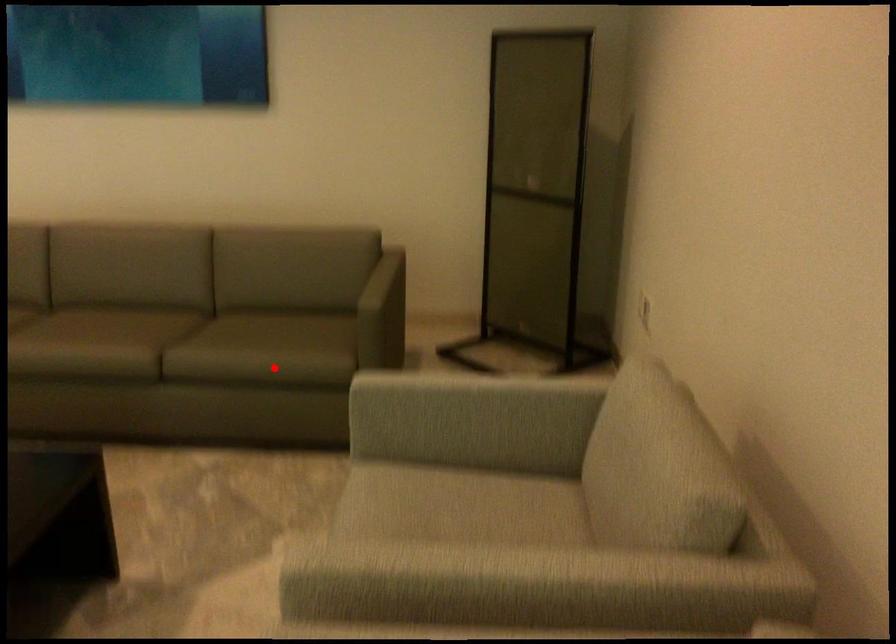
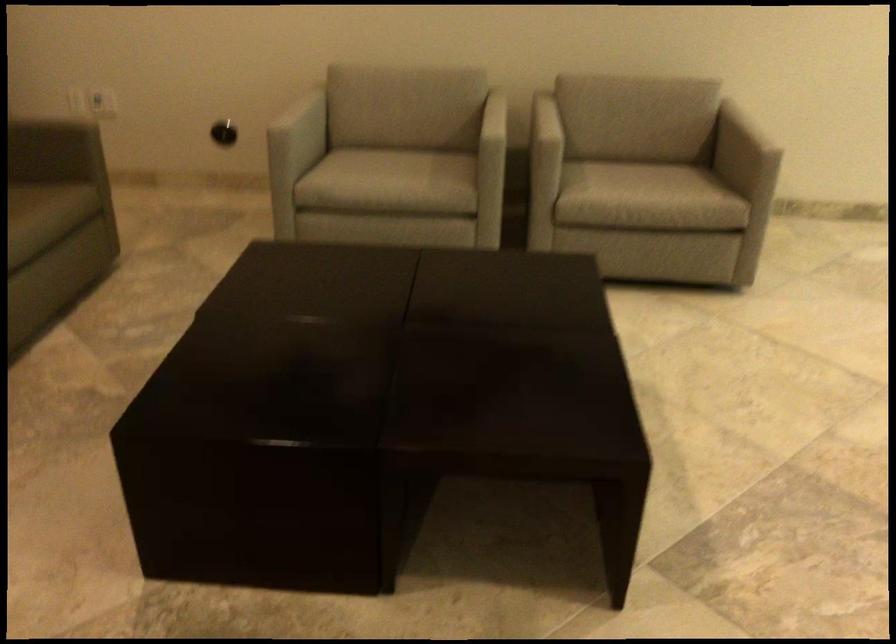
Locate, in the second image, the point that corresponds to the highlighted location in the first image.

(36, 219)